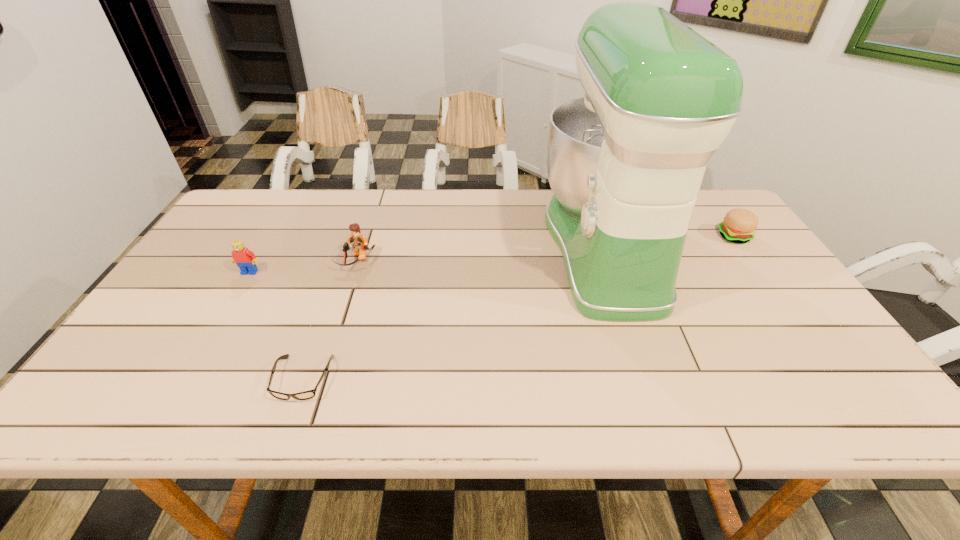
Locate an element on the screen. Image resolution: width=960 pixels, height=540 pixels. free space located 0.060m on the controls of the tallest object is located at coordinates (523, 248).

Where is `vacant space located holding a crossbow in the hands of the right Lego`? The width and height of the screenshot is (960, 540). vacant space located holding a crossbow in the hands of the right Lego is located at coordinates (324, 363).

The height and width of the screenshot is (540, 960). Identify the location of free region located on the face of the left Lego. (184, 384).

Identify the location of vacant region located on the front of the rightmost object. (767, 282).

At what (x,y) coordinates should I click in order to perform the action: click on mixer that is at the far edge. Please return your answer as a coordinate pair (x, y). The image size is (960, 540). Looking at the image, I should click on (625, 163).

Locate an element on the screen. This screenshot has height=540, width=960. hamburger that is at the far edge is located at coordinates (739, 225).

This screenshot has width=960, height=540. What are the coordinates of `object at the near edge` in the screenshot? It's located at click(306, 395).

You are a GUI agent. You are given a task and a screenshot of the screen. Output one action in this format:
    pyautogui.click(x=<x>, y=<y>)
    Task: Click on the object at the left edge
    This screenshot has height=540, width=960.
    Given the screenshot: What is the action you would take?
    pyautogui.click(x=245, y=259)

Image resolution: width=960 pixels, height=540 pixels. Find the location of `object located in the right edge section of the desktop`. object located in the right edge section of the desktop is located at coordinates (739, 225).

Where is `object that is at the far right corner`? This screenshot has height=540, width=960. object that is at the far right corner is located at coordinates (739, 225).